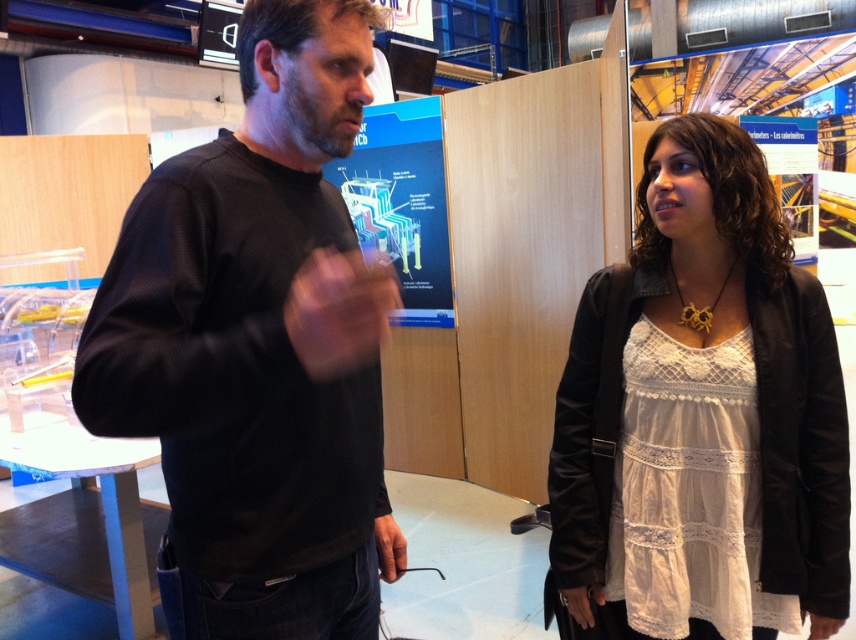
Question: Does black matte sweater at left have a smaller size compared to white lace dress at center?

Choices:
 (A) no
 (B) yes

Answer: (A)

Question: Does black matte sweater at left have a greater width compared to white lace dress at center?

Choices:
 (A) no
 (B) yes

Answer: (A)

Question: Can you confirm if black matte sweater at left is thinner than white lace dress at center?

Choices:
 (A) no
 (B) yes

Answer: (B)

Question: Which of the following is the farthest from the observer?

Choices:
 (A) white lace dress at center
 (B) black matte sweater at left

Answer: (A)

Question: Among these points, which one is farthest from the camera?

Choices:
 (A) (601, 636)
 (B) (337, 12)

Answer: (A)